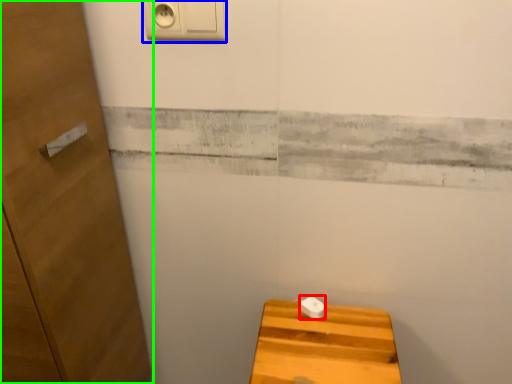
Question: Estimate the real-world distances between objects in this image. Which object is farther from knob (highlighted by a red box), light switch (highlighted by a blue box) or door (highlighted by a green box)?

Choices:
 (A) light switch
 (B) door

Answer: (A)